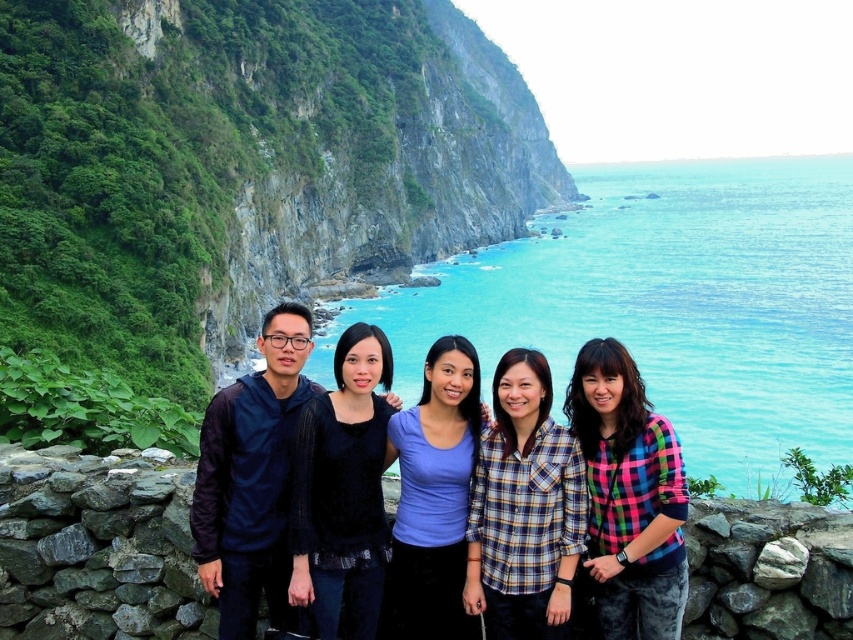
Who is shorter, green rock cliff at upper left or matte black jacket at center?

matte black jacket at center

Measure the distance from green rock cliff at upper left to matte black jacket at center.

They are 66.12 meters apart.

Does point (364, 189) come behind point (445, 433)?

Yes.

Locate an element on the screen. The height and width of the screenshot is (640, 853). green rock cliff at upper left is located at coordinates (241, 164).

Which is above, turquoise water at center or matte black jacket at center?

turquoise water at center

Between point (535, 326) and point (515, 365), which one is positioned in front?

Point (515, 365) is more forward.

At what (x,y) coordinates should I click in order to perform the action: click on turquoise water at center. Please return your answer as a coordinate pair (x, y). Looking at the image, I should click on (668, 305).

Who is positioned more to the right, green rock cliff at upper left or turquoise water at center?

From the viewer's perspective, turquoise water at center appears more on the right side.

Where is `green rock cliff at upper left`? This screenshot has width=853, height=640. green rock cliff at upper left is located at coordinates (241, 164).

The width and height of the screenshot is (853, 640). What are the coordinates of `green rock cliff at upper left` in the screenshot? It's located at (241, 164).